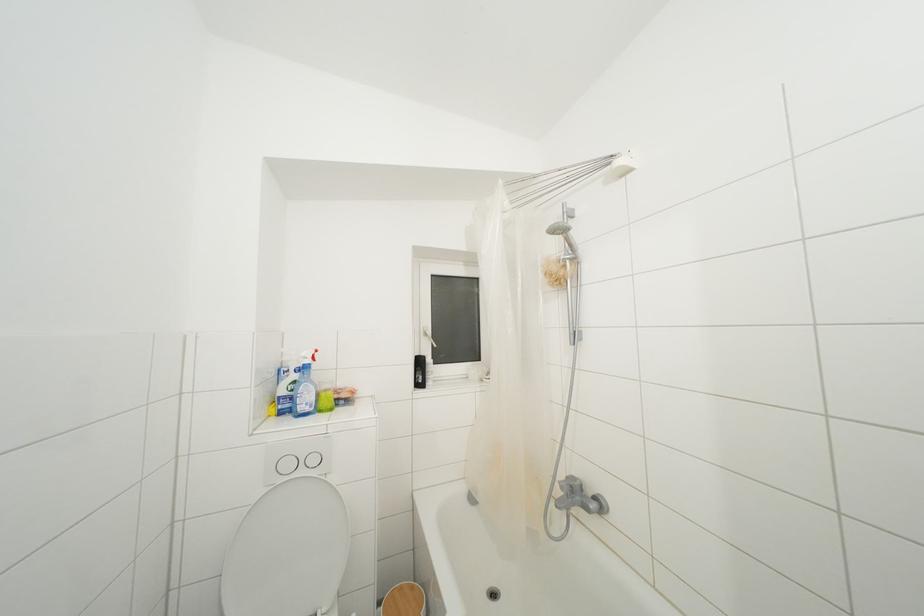
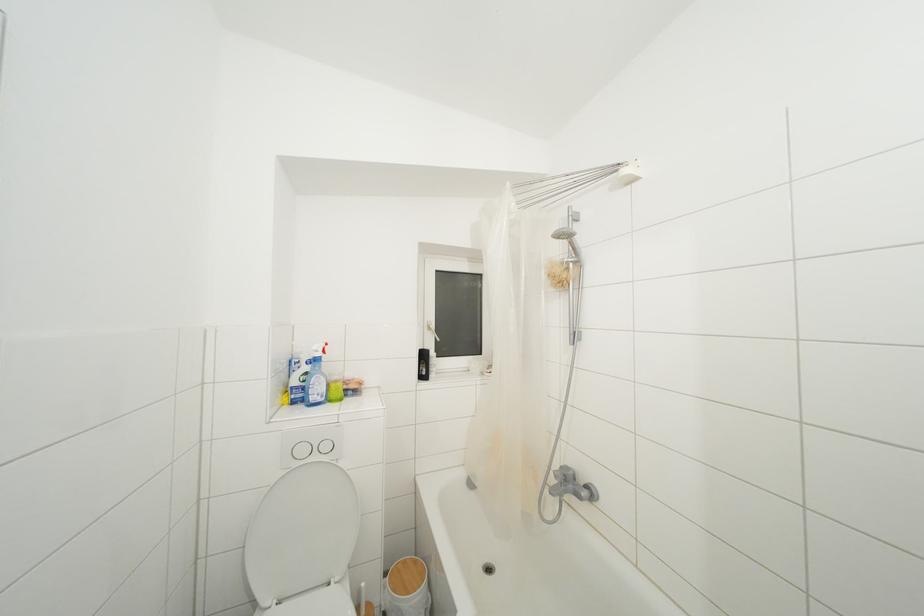
Find the pixel in the second image that matches point (430, 339) in the first image.

(433, 333)